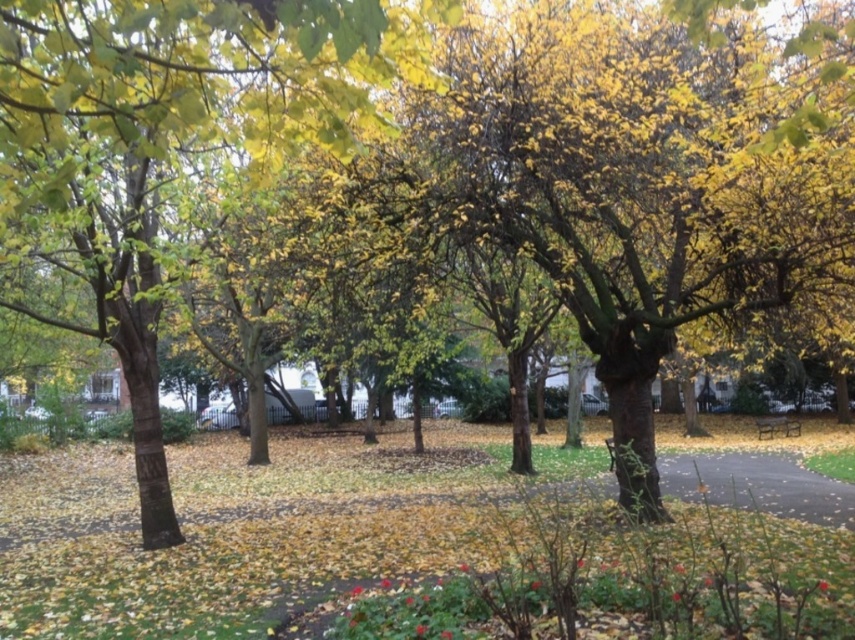
Question: Which point is farther to the camera?

Choices:
 (A) yellow-green leaves at center
 (B) metallic silver bench at lower right

Answer: (B)

Question: Which object is farther from the camera taking this photo?

Choices:
 (A) yellow-green leaves at center
 (B) metallic silver bench at lower right

Answer: (B)

Question: Is yellow-green leaves at center smaller than metallic silver bench at lower right?

Choices:
 (A) no
 (B) yes

Answer: (B)

Question: Can you confirm if yellow-green leaves at center is smaller than metallic silver bench at lower right?

Choices:
 (A) no
 (B) yes

Answer: (B)

Question: Does yellow-green leaves at center appear over metallic silver bench at lower right?

Choices:
 (A) yes
 (B) no

Answer: (A)